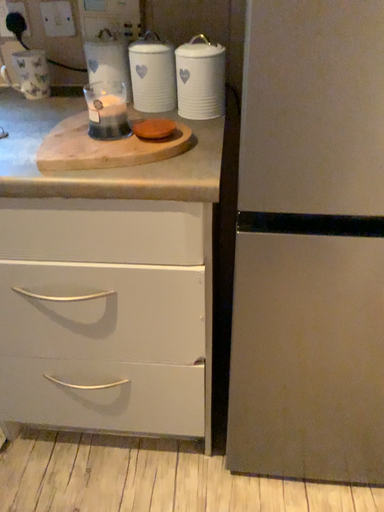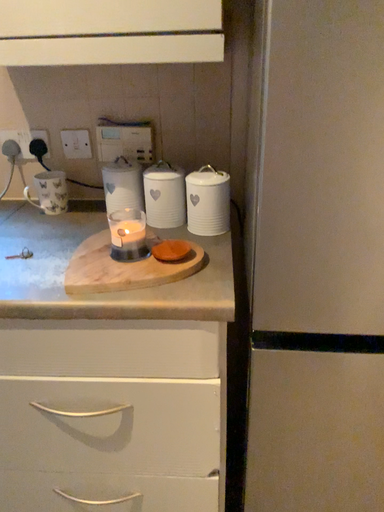
Question: How did the camera likely rotate when shooting the video?

Choices:
 (A) rotated downward
 (B) rotated upward

Answer: (B)